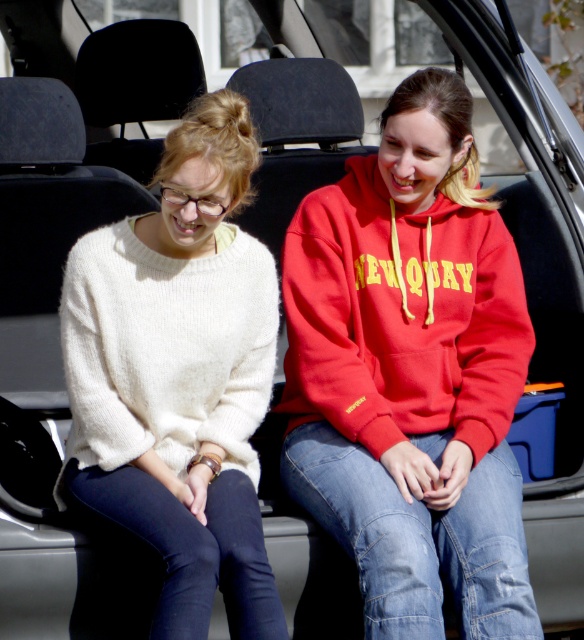
Based on the photo, you are trying to determine the order of the two people sitting in the car trunk from front to back. The person wearing the red hoodie with the word NEWQUAY is at point (380, 353), and the person in the cream sweater is at point (214, 128). According to the coordinates provided, which person is sitting further back in the trunk?

The person wearing the red hoodie with the word NEWQUAY at point (380, 353) is sitting further back in the trunk because the coordinate point (380, 353) is behind point (214, 128).

Based on the photo, you are standing at the point marked by the coordinates point (411, 372). Which object is directly in front of you?

The point (411, 372) indicates the matte red hoodie at center, so the matte red hoodie at center is directly in front of you.

You are trying to decide which of the two jackets in the car trunk to take for a cold evening. The matte red hoodie at center and the white fuzzy sweater at left are both available. Based on their sizes, which one would you choose and why?

The matte red hoodie at center is larger in size than the white fuzzy sweater at left, so you should choose the matte red hoodie at center because it can provide more warmth and coverage for a cold evening.